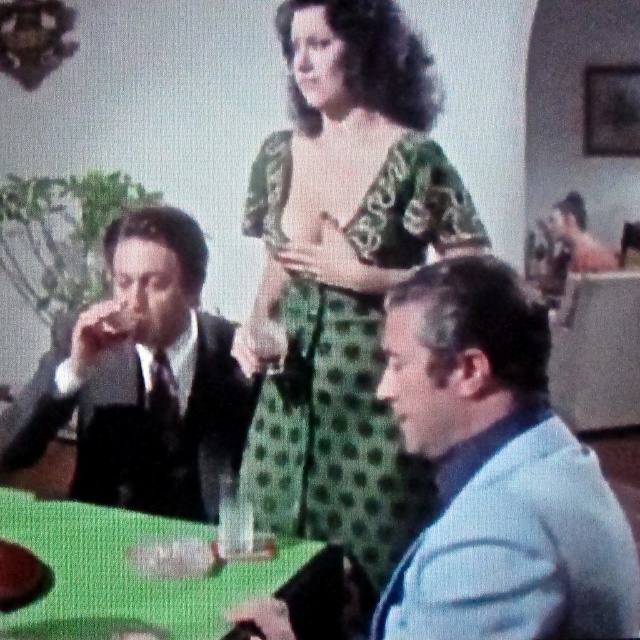
Which is behind, point (461, 509) or point (225, 593)?

The point (225, 593) is behind.

Can you confirm if light blue fabric jacket at center is thinner than green glossy table at lower center?

Yes, light blue fabric jacket at center is thinner than green glossy table at lower center.

The width and height of the screenshot is (640, 640). Describe the element at coordinates (497, 472) in the screenshot. I see `light blue fabric jacket at center` at that location.

Where is `light blue fabric jacket at center`? light blue fabric jacket at center is located at coordinates (497, 472).

Can you confirm if green dotted fabric dress at center is positioned below green glossy table at lower center?

No.

Which is below, green dotted fabric dress at center or green glossy table at lower center?

green glossy table at lower center is lower down.

The height and width of the screenshot is (640, 640). I want to click on green dotted fabric dress at center, so click(332, 433).

Is point (518, 372) less distant than point (419, 173)?

Yes, it is.

Between point (467, 484) and point (301, 317), which one is positioned behind?

Point (301, 317)

The width and height of the screenshot is (640, 640). In order to click on light blue fabric jacket at center in this screenshot , I will do tap(497, 472).